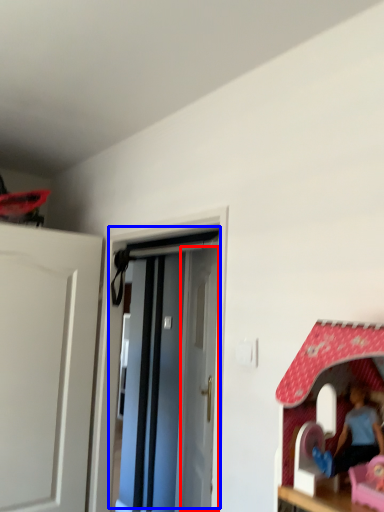
Question: Which object is closer to the camera taking this photo, door (highlighted by a red box) or door (highlighted by a blue box)?

Choices:
 (A) door
 (B) door

Answer: (B)